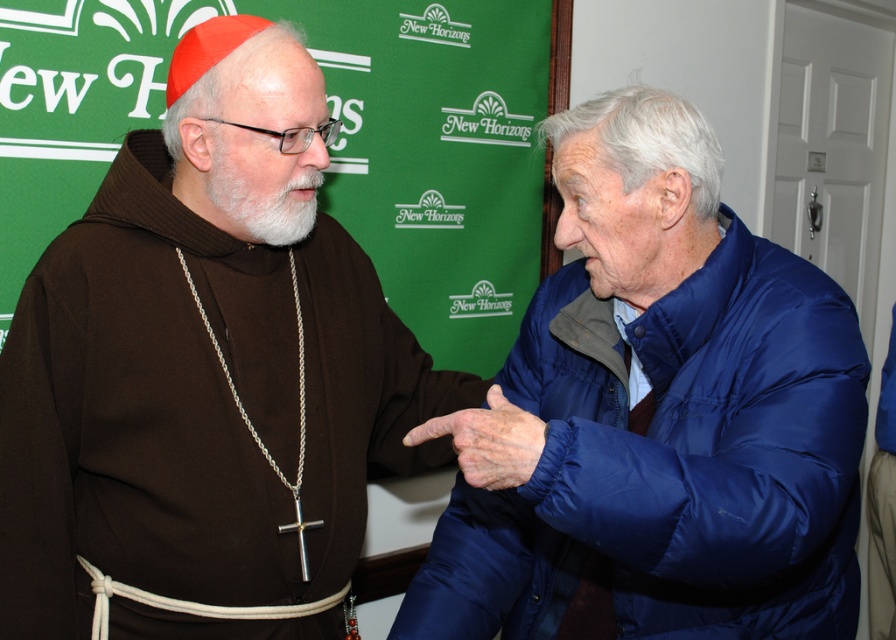
You are standing in the room where the two people are talking. You need to walk to one of the two points marked in the image. The first point is at coordinates point [220,316] and the second is at point [527,477]. Which point should you choose if you want to reach the one that is closer to you?

You should choose point [220,316] because it is closer to you than point [527,477].

Looking at this image, you are standing in the room where the two people are talking. You need to locate the brown woolen robe at left. Where exactly is it located in the room?

The brown woolen robe at left is located at point (205, 372) in the room.

You are standing in the room where the scene is taking place. You need to locate the brown woolen robe at left. Where would you look relative to the center of the room?

The brown woolen robe at left is located at 2D coordinates point (205, 372) relative to the center of the room.